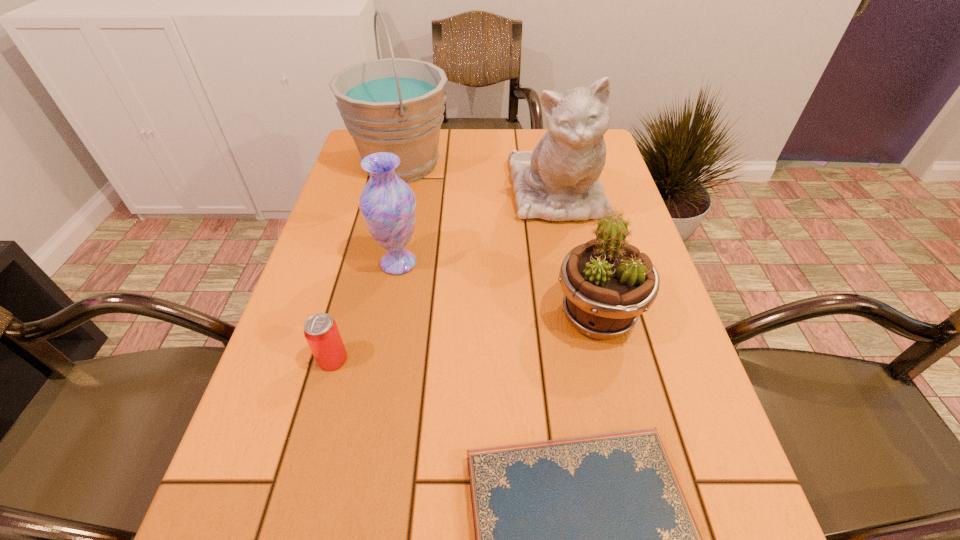
Identify the location of free space that satisfies the following two spatial constraints: 1. on the front-facing side of the flowerpot; 2. on the left side of the cat. The image size is (960, 540). (583, 316).

Identify the location of free space that satisfies the following two spatial constraints: 1. on the back side of the fifth tallest object; 2. on the right side of the bucket. (386, 163).

Locate an element on the screen. vacant space that satisfies the following two spatial constraints: 1. on the back side of the can; 2. on the left side of the bucket is located at coordinates (386, 163).